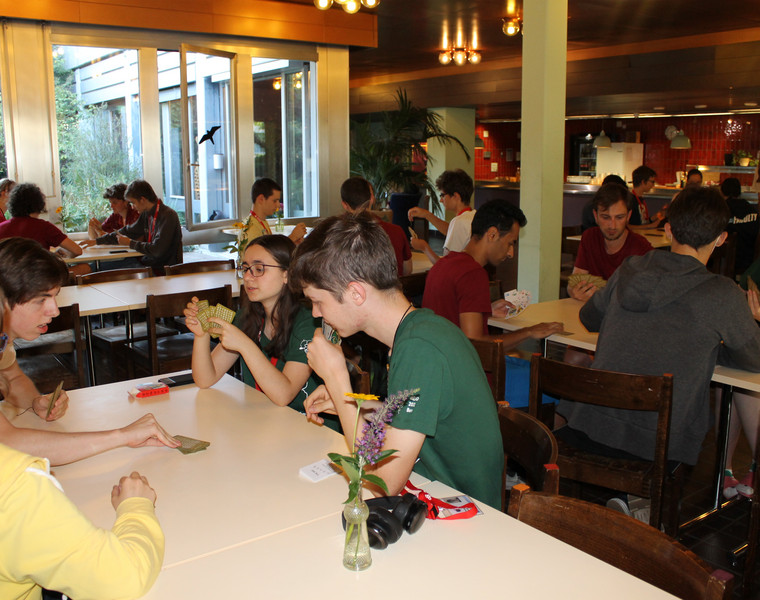
The image size is (760, 600). What are the coordinates of `headphones on table` in the screenshot? It's located at (400, 513).